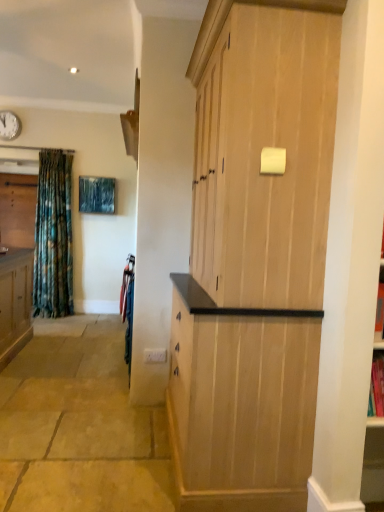
This screenshot has height=512, width=384. In order to click on white matte clock at upper left in this screenshot , I will do `click(9, 125)`.

What do you see at coordinates (9, 125) in the screenshot? I see `white matte clock at upper left` at bounding box center [9, 125].

Measure the distance between natural wood cupboard at center and camera.

natural wood cupboard at center is 5.51 feet from camera.

Where is `natural wood cupboard at center`? The width and height of the screenshot is (384, 512). natural wood cupboard at center is located at coordinates (255, 264).

What do you see at coordinates (255, 264) in the screenshot? The width and height of the screenshot is (384, 512). I see `natural wood cupboard at center` at bounding box center [255, 264].

Identify the location of white matte clock at upper left. (9, 125).

Considering the relative positions of white matte clock at upper left and natural wood cupboard at center in the image provided, is white matte clock at upper left to the left of natural wood cupboard at center from the viewer's perspective?

Yes.

Does white matte clock at upper left lie in front of natural wood cupboard at center?

No, the depth of white matte clock at upper left is greater than that of natural wood cupboard at center.

Which is behind, point (16, 130) or point (217, 177)?

The point (16, 130) is farther.

From the image's perspective, is white matte clock at upper left located above or below natural wood cupboard at center?

From the image's perspective, white matte clock at upper left appears above natural wood cupboard at center.

From a real-world perspective, who is located lower, white matte clock at upper left or natural wood cupboard at center?

natural wood cupboard at center, from a real-world perspective.

Is white matte clock at upper left thinner than natural wood cupboard at center?

Correct, the width of white matte clock at upper left is less than that of natural wood cupboard at center.

Who is shorter, white matte clock at upper left or natural wood cupboard at center?

white matte clock at upper left is shorter.

Between white matte clock at upper left and natural wood cupboard at center, which one has smaller size?

With smaller size is white matte clock at upper left.

Is white matte clock at upper left located outside natural wood cupboard at center?

That's correct, white matte clock at upper left is outside of natural wood cupboard at center.

Does white matte clock at upper left touch natural wood cupboard at center?

No, white matte clock at upper left is not making contact with natural wood cupboard at center.

Is white matte clock at upper left looking in the opposite direction of natural wood cupboard at center?

No, natural wood cupboard at center is not at the back of white matte clock at upper left.

How different are the orientations of white matte clock at upper left and natural wood cupboard at center in degrees?

89.9 degrees.

The height and width of the screenshot is (512, 384). What are the coordinates of `clock on the left side of natural wood cupboard at center` in the screenshot? It's located at (9, 125).

Considering the positions of objects natural wood cupboard at center and white matte clock at upper left in the image provided, who is more to the left, natural wood cupboard at center or white matte clock at upper left?

From the viewer's perspective, white matte clock at upper left appears more on the left side.

Which object is closer to the camera, natural wood cupboard at center or white matte clock at upper left?

Positioned in front is natural wood cupboard at center.

Which is behind, point (187, 370) or point (15, 124)?

The point (15, 124) is more distant.

From the image's perspective, is natural wood cupboard at center above white matte clock at upper left?

No, from the image's perspective, natural wood cupboard at center is not above white matte clock at upper left.

From a real-world perspective, between natural wood cupboard at center and white matte clock at upper left, who is vertically lower?

From a 3D spatial view, natural wood cupboard at center is below.

Which object is wider, natural wood cupboard at center or white matte clock at upper left?

natural wood cupboard at center.

In terms of height, does natural wood cupboard at center look taller or shorter compared to white matte clock at upper left?

natural wood cupboard at center is taller than white matte clock at upper left.

Is natural wood cupboard at center smaller than white matte clock at upper left?

Incorrect, natural wood cupboard at center is not smaller in size than white matte clock at upper left.

From the picture: Do you think natural wood cupboard at center is within white matte clock at upper left, or outside of it?

natural wood cupboard at center is not enclosed by white matte clock at upper left.

Is natural wood cupboard at center positioned far away from white matte clock at upper left?

natural wood cupboard at center is positioned a significant distance from white matte clock at upper left.

Could you tell me if natural wood cupboard at center is turned towards white matte clock at upper left?

No, natural wood cupboard at center is not oriented towards white matte clock at upper left.

Measure the distance from natural wood cupboard at center to white matte clock at upper left.

A distance of 4.56 meters exists between natural wood cupboard at center and white matte clock at upper left.

At what (x,y) coordinates should I click in order to perform the action: click on clock above the natural wood cupboard at center (from the image's perspective). Please return your answer as a coordinate pair (x, y). Looking at the image, I should click on (9, 125).

You are a GUI agent. You are given a task and a screenshot of the screen. Output one action in this format:
    pyautogui.click(x=<x>, y=<y>)
    Task: Click on the cupboard lying below the white matte clock at upper left (from the image's perspective)
    The image size is (384, 512).
    Given the screenshot: What is the action you would take?
    pyautogui.click(x=255, y=264)

This screenshot has height=512, width=384. In the image, there is a white matte clock at upper left. Identify the location of cupboard below it (from a real-world perspective). (255, 264).